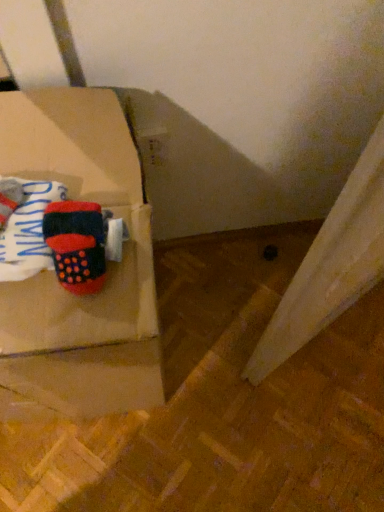
Question: Can you confirm if matte cardboard box at left is bigger than velvet-like red phone at upper left?

Choices:
 (A) yes
 (B) no

Answer: (A)

Question: Does matte cardboard box at left have a greater width compared to velvet-like red phone at upper left?

Choices:
 (A) yes
 (B) no

Answer: (A)

Question: Does matte cardboard box at left have a lesser height compared to velvet-like red phone at upper left?

Choices:
 (A) yes
 (B) no

Answer: (B)

Question: Is matte cardboard box at left to the right of velvet-like red phone at upper left from the viewer's perspective?

Choices:
 (A) no
 (B) yes

Answer: (A)

Question: From the image's perspective, is matte cardboard box at left below velvet-like red phone at upper left?

Choices:
 (A) yes
 (B) no

Answer: (A)

Question: Does matte cardboard box at left have a greater height compared to velvet-like red phone at upper left?

Choices:
 (A) no
 (B) yes

Answer: (B)

Question: From the image's perspective, does velvet-like red phone at upper left appear higher than knitted wool socks at left?

Choices:
 (A) yes
 (B) no

Answer: (B)

Question: From the image's perspective, is velvet-like red phone at upper left below knitted wool socks at left?

Choices:
 (A) yes
 (B) no

Answer: (A)

Question: Can you confirm if velvet-like red phone at upper left is positioned to the left of knitted wool socks at left?

Choices:
 (A) no
 (B) yes

Answer: (A)

Question: From a real-world perspective, is velvet-like red phone at upper left located beneath knitted wool socks at left?

Choices:
 (A) no
 (B) yes

Answer: (B)

Question: Is the position of velvet-like red phone at upper left more distant than that of knitted wool socks at left?

Choices:
 (A) no
 (B) yes

Answer: (B)

Question: Is velvet-like red phone at upper left in contact with knitted wool socks at left?

Choices:
 (A) yes
 (B) no

Answer: (A)

Question: Is knitted wool socks at left thinner than matte cardboard box at left?

Choices:
 (A) no
 (B) yes

Answer: (B)